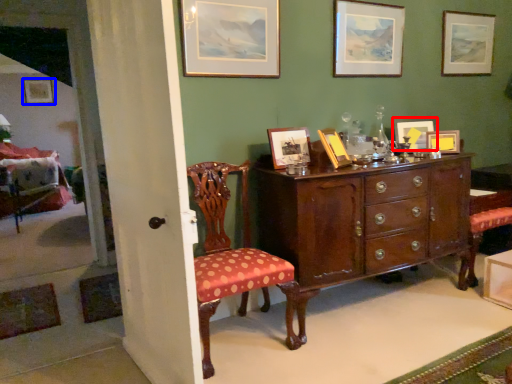
Question: Which of the following is the closest to the observer, picture frame (highlighted by a red box) or picture frame (highlighted by a blue box)?

Choices:
 (A) picture frame
 (B) picture frame

Answer: (A)